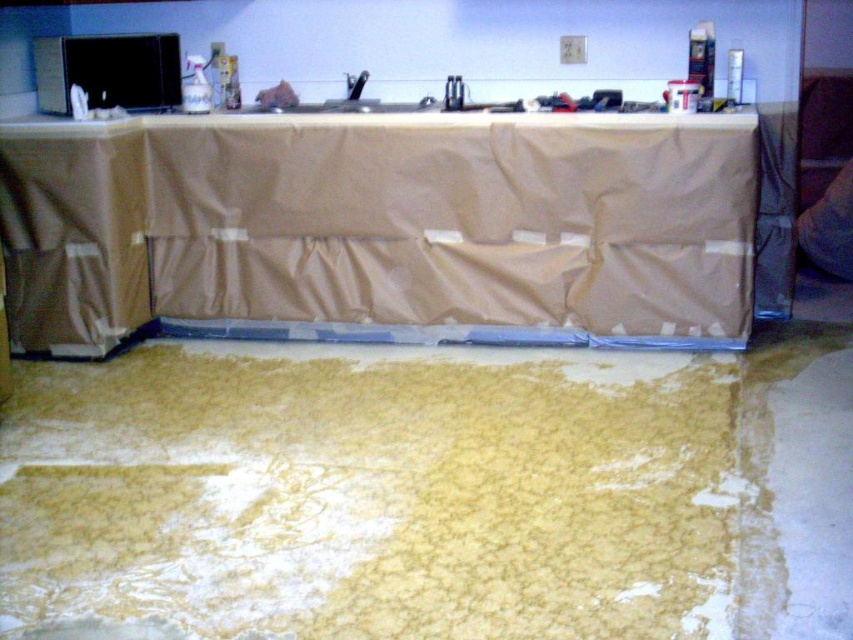
Is point (670, 468) more distant than point (190, 275)?

No, it is in front of (190, 275).

Does yellow crumbly food at lower center have a greater height compared to tan fabric-covered table at center?

No.

Who is more distant from viewer, (175, 426) or (265, 214)?

The point (265, 214) is more distant.

I want to click on yellow crumbly food at lower center, so click(x=370, y=493).